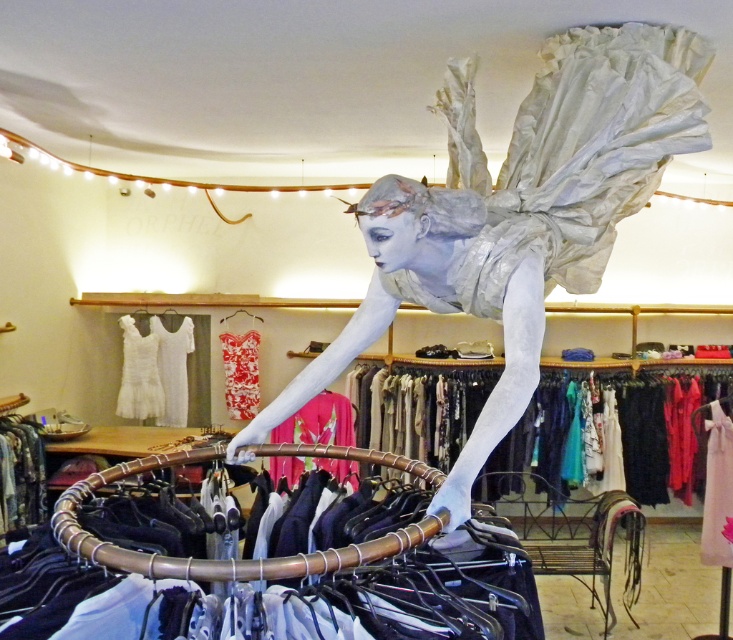
Question: Which of the following is the farthest from the observer?

Choices:
 (A) silky black dress at center
 (B) floral fabric dress at lower left
 (C) white lace dress at left
 (D) white fabric hanger at center

Answer: (D)

Question: Considering the real-world distances, which object is farthest from the white lace dress at center?

Choices:
 (A) white lace dress at left
 (B) matte silver ballerina at center

Answer: (B)

Question: Which object is closer to the camera taking this photo?

Choices:
 (A) white lace dress at left
 (B) pink satin blouse at center
 (C) floral fabric dress at lower left

Answer: (B)

Question: Can you confirm if matte silver ballerina at center is wider than silky black dress at center?

Choices:
 (A) no
 (B) yes

Answer: (A)

Question: Can you confirm if pink satin blouse at center is thinner than white fabric hanger at center?

Choices:
 (A) no
 (B) yes

Answer: (A)

Question: Is floral fabric dress at lower left wider than white lace dress at left?

Choices:
 (A) yes
 (B) no

Answer: (B)